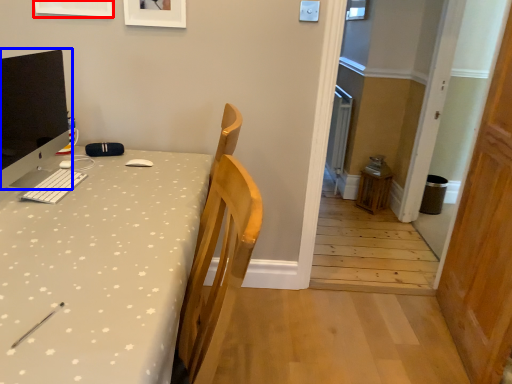
Question: Which of the following is the farthest to the observer, picture frame (highlighted by a red box) or computer monitor (highlighted by a blue box)?

Choices:
 (A) picture frame
 (B) computer monitor

Answer: (A)